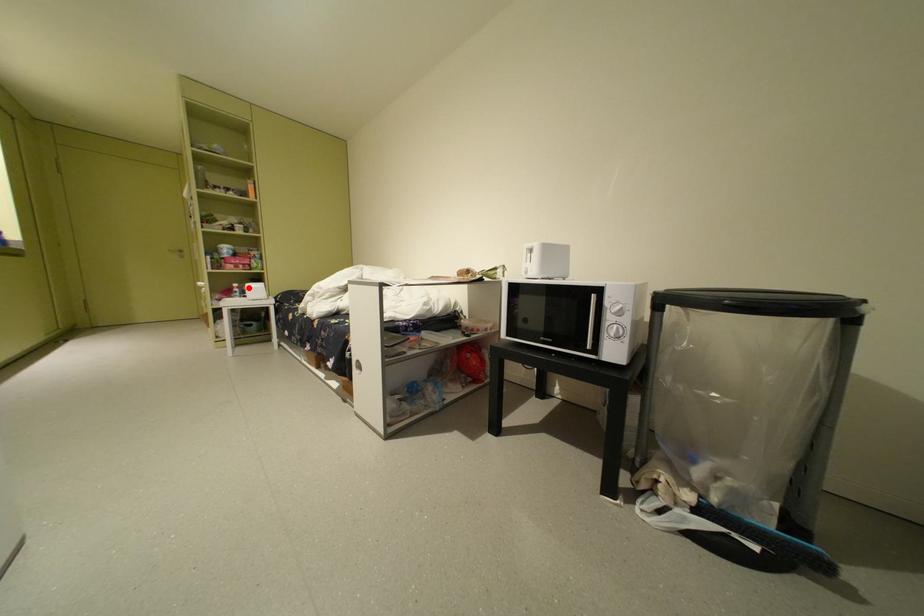
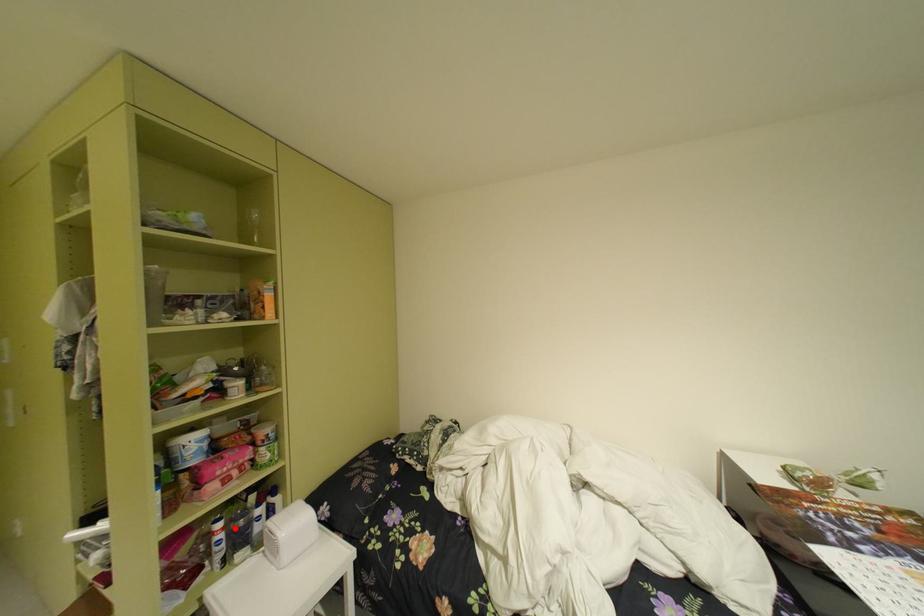
In the scene shown: I am providing you with two images of the same scene from different viewpoints. A red point is marked on the first image and another point is marked on the second image. Is the marked point in image1 the same physical position as the marked point in image2?

Yes